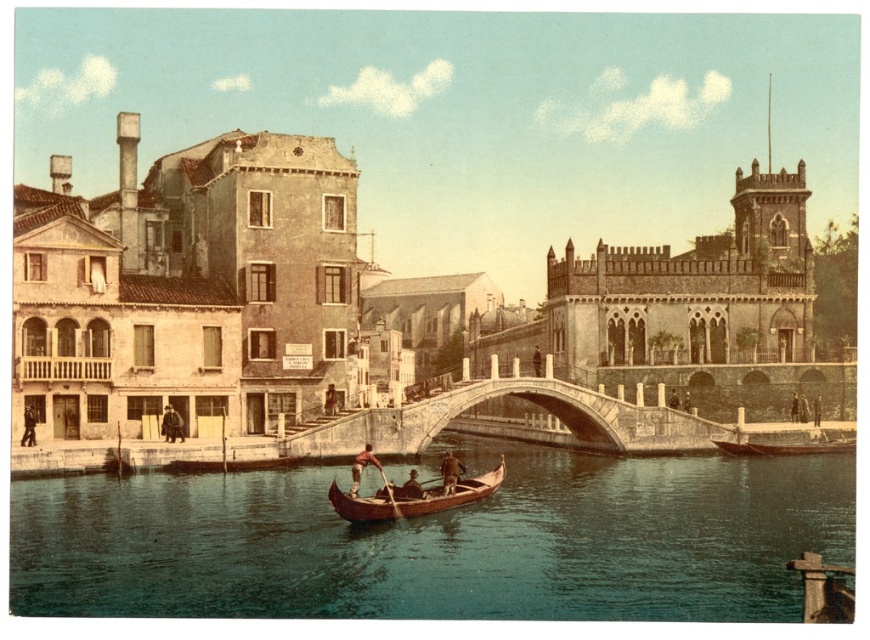
In the scene shown: You are a tourist in Venice and see the brown leather boat at center and the smooth brown leather oar at center in the canal. Which object takes up more space in the image?

The brown leather boat at center is bigger than the smooth brown leather oar at center, so it takes up more space in the image.

You are a tourist standing on the bridge overlooking the canal. You see the brown leather boat at center and the smooth brown leather oar at center. Which object is taller?

The brown leather boat at center is much taller than the smooth brown leather oar at center.